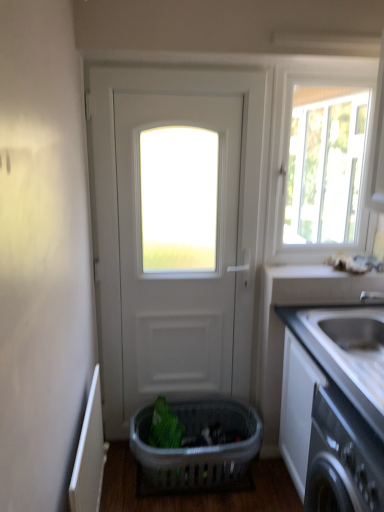
Question: Is plastic basket at center with white glossy window at upper right?

Choices:
 (A) no
 (B) yes

Answer: (A)

Question: From the image's perspective, is plastic basket at center over white glossy window at upper right?

Choices:
 (A) no
 (B) yes

Answer: (A)

Question: From a real-world perspective, is plastic basket at center physically below white glossy window at upper right?

Choices:
 (A) no
 (B) yes

Answer: (B)

Question: Is plastic basket at center far from white glossy window at upper right?

Choices:
 (A) yes
 (B) no

Answer: (A)

Question: Is white glossy window at upper right a part of plastic basket at center?

Choices:
 (A) no
 (B) yes

Answer: (A)

Question: In terms of width, does plastic basket at center look wider or thinner when compared to white matte door at center?

Choices:
 (A) wide
 (B) thin

Answer: (A)

Question: Is plastic basket at center taller or shorter than white matte door at center?

Choices:
 (A) short
 (B) tall

Answer: (A)

Question: In the image, is plastic basket at center positioned in front of or behind white matte door at center?

Choices:
 (A) front
 (B) behind

Answer: (B)

Question: Is plastic basket at center inside or outside of white matte door at center?

Choices:
 (A) inside
 (B) outside

Answer: (B)

Question: From a real-world perspective, is plastic basket at center positioned above or below white glossy countertop at right?

Choices:
 (A) below
 (B) above

Answer: (A)

Question: Is plastic basket at center to the left or to the right of white glossy countertop at right in the image?

Choices:
 (A) right
 (B) left

Answer: (B)

Question: Relative to white glossy countertop at right, is plastic basket at center in front or behind?

Choices:
 (A) front
 (B) behind

Answer: (B)

Question: Considering the positions of plastic basket at center and white glossy countertop at right in the image, is plastic basket at center wider or thinner than white glossy countertop at right?

Choices:
 (A) wide
 (B) thin

Answer: (B)

Question: Looking at their shapes, would you say white glossy countertop at right is wider or thinner than white glossy window at upper right?

Choices:
 (A) thin
 (B) wide

Answer: (B)

Question: In the image, is white glossy countertop at right positioned in front of or behind white glossy window at upper right?

Choices:
 (A) front
 (B) behind

Answer: (A)